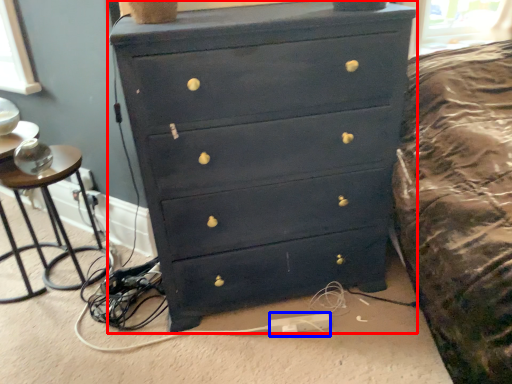
Question: Which point is closer to the camera, chest of drawers (highlighted by a red box) or extension cord (highlighted by a blue box)?

Choices:
 (A) chest of drawers
 (B) extension cord

Answer: (A)